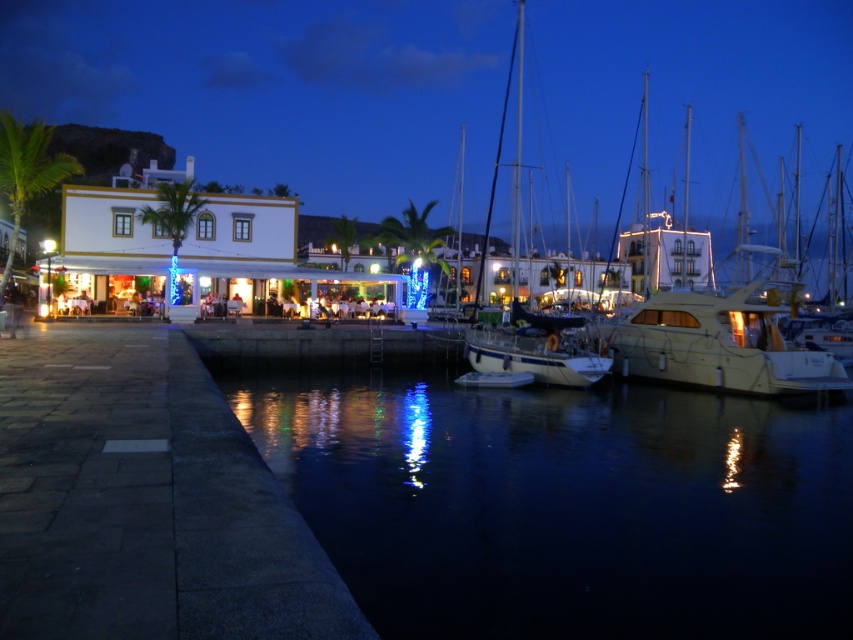
You are a dock worker who needs to park a new boat that is 10 meters long. You have two spots available next to the matte yellow boat at right and the white glossy sailboat at center. Based on their widths, which spot can accommodate the new boat more safely?

The white glossy sailboat at center has a greater width than the matte yellow boat at right. Therefore, the parking spot next to the white glossy sailboat at center would provide more space for the new boat to be parked safely.

You are standing on the paved walkway at the water edge and want to take a photo of the white glossy yacht at center. Which direction should you face to ensure the yacht is in the center of your camera frame?

Since the white glossy yacht at center is located at point coordinates, you should face directly towards the coordinates where it is positioned to center it in your camera frame.

You are standing on the walkway and want to take a photo of both the matte yellow boat at right and the white glossy sailboat at center. Which boat will appear smaller in the photo?

The white glossy sailboat at center will appear smaller because it is positioned behind the matte yellow boat at right, making it farther away from the camera.